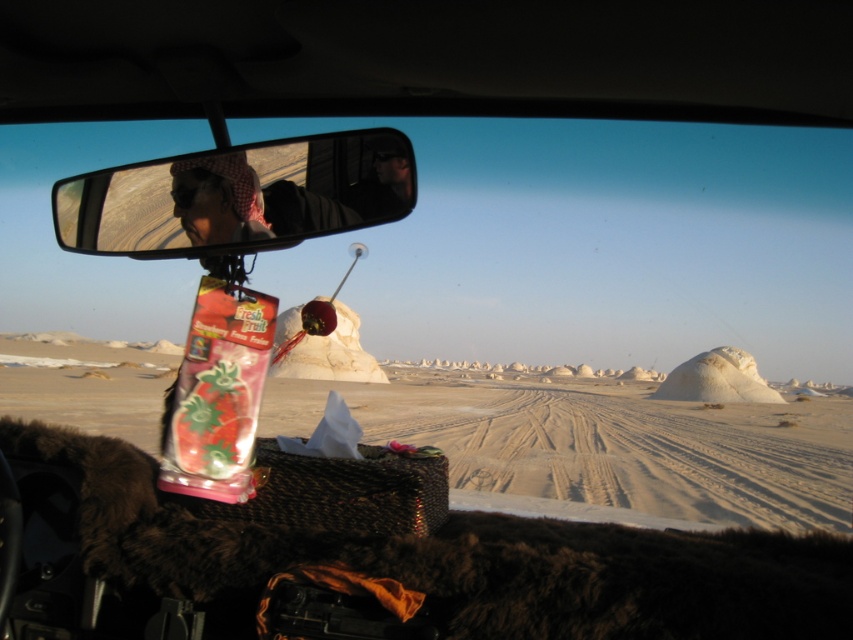
Consider the image. You are a passenger in the car and want to describe the view outside. Based on the coordinates provided, what is the main feature visible at point (605, 444)?

The point (605, 444) indicates white sandy desert at center.

You are a photographer planning to take a photo of the white sandy desert at center and the matte black headscarf at upper center. Given that your camera can capture objects up to 50 feet apart in the same frame, will both subjects fit in your shot?

The white sandy desert at center and the matte black headscarf at upper center are 47.37 feet apart from each other, which is within the camera range of 50 feet. Therefore, both subjects will fit in the same frame.

You are sitting in the back seat of the car and want to reach out to touch the white sandy desert at center outside the window. Considering the car door is open, can you reach it with your hand?

The white sandy desert at center is 7.03 feet away from the viewer. Since an average human arm length is about 2.5 feet, you cannot reach it with your hand.